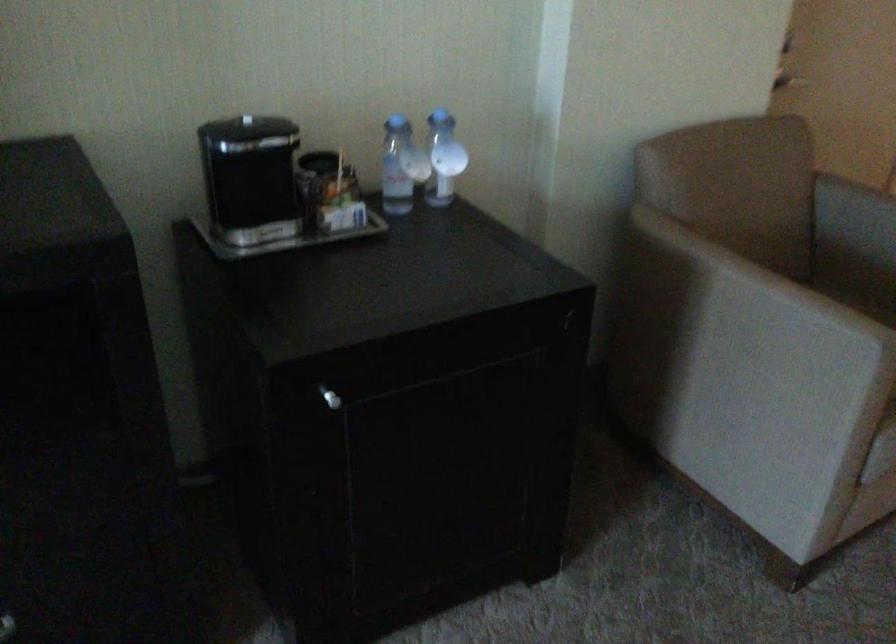
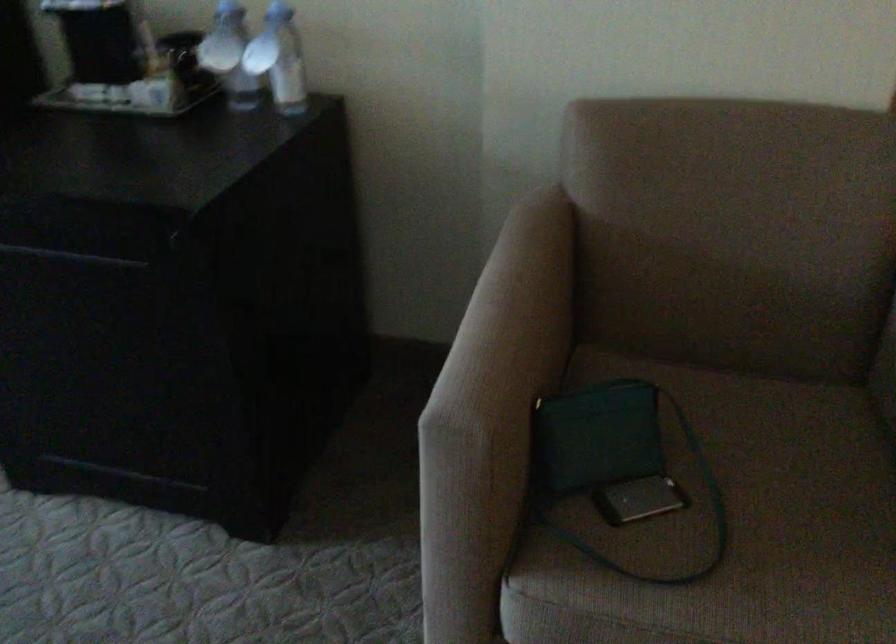
In the second image, find the point that corresponds to pixel 412 167 in the first image.

(229, 55)